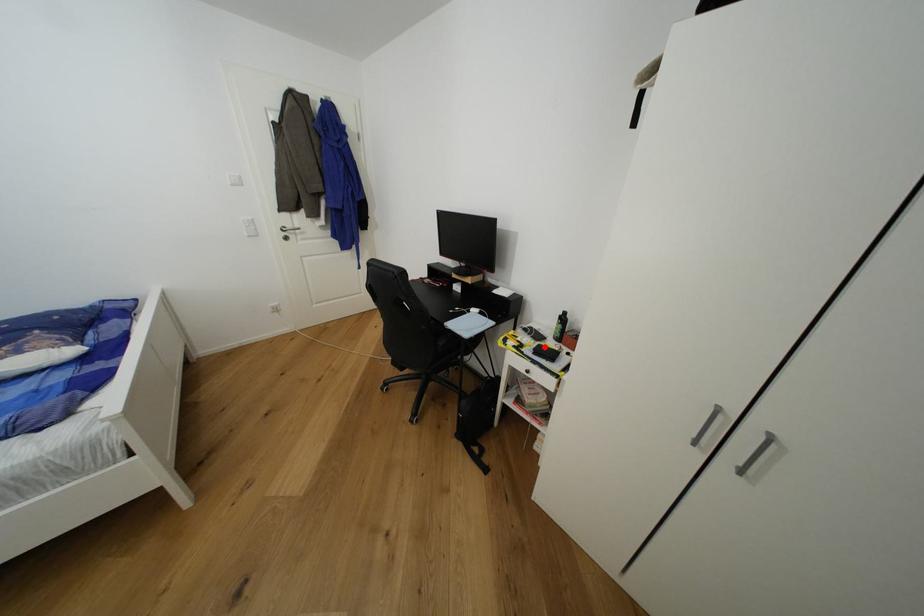
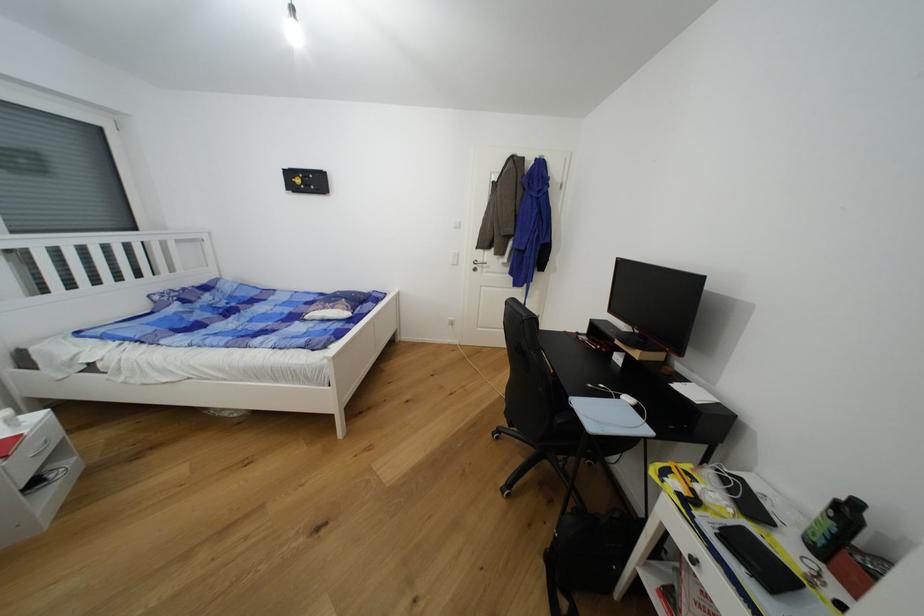
The point at the highlighted location is marked in the first image. Where is the corresponding point in the second image?

(748, 531)